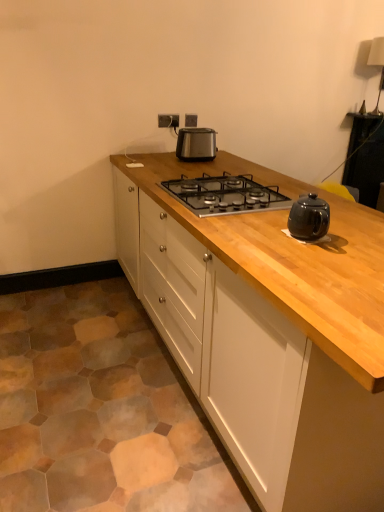
Question: From a real-world perspective, relative to natural wood cabinet at center, is satin silver outlet at upper center vertically above or below?

Choices:
 (A) above
 (B) below

Answer: (A)

Question: Is satin silver outlet at upper center in front of or behind natural wood cabinet at center in the image?

Choices:
 (A) behind
 (B) front

Answer: (A)

Question: Estimate the real-world distances between objects in this image. Which object is closer to the satin silver outlet at upper center?

Choices:
 (A) natural wood cabinet at center
 (B) black glass gas stove at center
 (C) satin black toaster at center

Answer: (C)

Question: Which object is the closest to the natural wood cabinet at center?

Choices:
 (A) satin silver outlet at upper center
 (B) black glass gas stove at center
 (C) satin black toaster at center

Answer: (B)